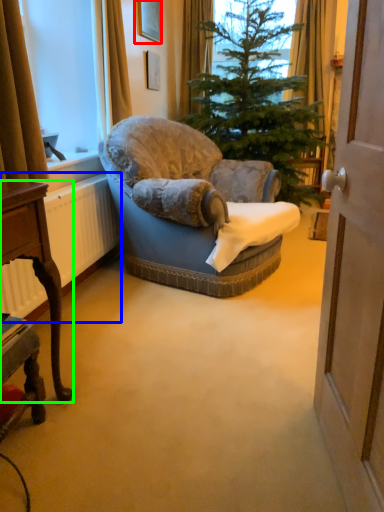
Question: Based on their relative distances, which object is nearer to picture frame (highlighted by a red box)? Choose from radiator (highlighted by a blue box) and desk (highlighted by a green box).

Choices:
 (A) radiator
 (B) desk

Answer: (A)